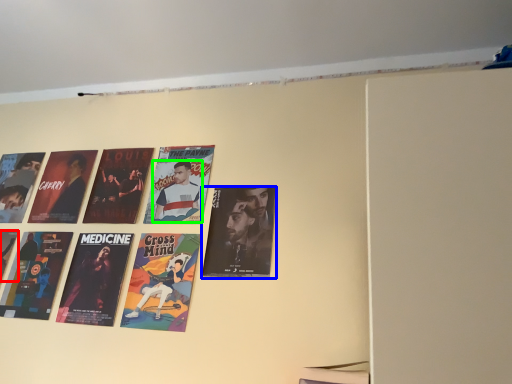
Question: Which object is positioned farthest from poster (highlighted by a red box)? Select from poster (highlighted by a blue box) and person (highlighted by a green box).

Choices:
 (A) poster
 (B) person

Answer: (A)